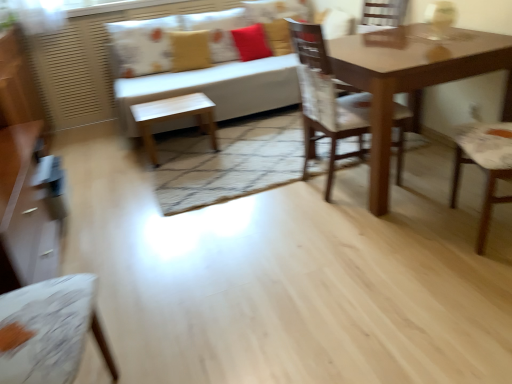
What do you see at coordinates (142, 46) in the screenshot?
I see `printed fabric pillow at upper center, which is counted as the third pillow, starting from the right` at bounding box center [142, 46].

Identify the location of white fabric couch at upper center. This screenshot has width=512, height=384. (217, 88).

In the scene shown: What is the approximate height of matte brown dresser at left?

The height of matte brown dresser at left is 99.64 centimeters.

Find the location of `matte yellow pillow at upper center, arranged as the second pillow when viewed from the left`. matte yellow pillow at upper center, arranged as the second pillow when viewed from the left is located at coordinates (190, 50).

How much space does matte yellow pillow at upper center, which is the 2th pillow from right to left, occupy vertically?

matte yellow pillow at upper center, which is the 2th pillow from right to left, is 15.11 inches tall.

What is the approximate height of red velvet cushion at upper center, the 3th pillow positioned from the left?

red velvet cushion at upper center, the 3th pillow positioned from the left, is 39.88 centimeters tall.

What do you see at coordinates (173, 118) in the screenshot? I see `light wood/finely finished table at center` at bounding box center [173, 118].

Where is `printed fabric pillow at upper center, which is counted as the third pillow, starting from the right`? The width and height of the screenshot is (512, 384). printed fabric pillow at upper center, which is counted as the third pillow, starting from the right is located at coordinates (142, 46).

Is white fabric couch at upper center facing towards matte brown table at center?

Yes, white fabric couch at upper center faces towards matte brown table at center.

This screenshot has height=384, width=512. What are the coordinates of `round table to the right of white fabric couch at upper center` in the screenshot? It's located at (413, 83).

From the image's perspective, is white fabric couch at upper center located above or below matte brown table at center?

Based on their image positions, white fabric couch at upper center is located above matte brown table at center.

Considering the points (247, 36) and (174, 70), which point is in front, point (247, 36) or point (174, 70)?

The point (174, 70) is in front.

Is red velvet cushion at upper center, the 1th pillow when ordered from right to left, positioned beyond the bounds of matte yellow pillow at upper center, arranged as the second pillow when viewed from the left?

Yes, red velvet cushion at upper center, the 1th pillow when ordered from right to left, is not within matte yellow pillow at upper center, arranged as the second pillow when viewed from the left.

Which of these two, red velvet cushion at upper center, the 1th pillow when ordered from right to left, or matte yellow pillow at upper center, arranged as the second pillow when viewed from the left, is thinner?

matte yellow pillow at upper center, arranged as the second pillow when viewed from the left, is thinner.

Consider the image. From the image's perspective, between red velvet cushion at upper center, the 1th pillow when ordered from right to left, and matte yellow pillow at upper center, which is the 2th pillow from right to left, who is located below?

matte yellow pillow at upper center, which is the 2th pillow from right to left, is shown below in the image.

Consider the image. From the image's perspective, who appears lower, printed fabric pillow at upper center, which is counted as the third pillow, starting from the right, or white fabric couch at upper center?

white fabric couch at upper center, from the image's perspective.

In terms of width, does printed fabric pillow at upper center, arranged as the 1th pillow when viewed from the left, look wider or thinner when compared to white fabric couch at upper center?

printed fabric pillow at upper center, arranged as the 1th pillow when viewed from the left, is thinner than white fabric couch at upper center.

Considering the positions of point (137, 48) and point (132, 118), is point (137, 48) closer or farther from the camera than point (132, 118)?

Clearly, point (137, 48) is more distant from the camera than point (132, 118).

Is point (186, 45) positioned before point (148, 114)?

That is False.

From the image's perspective, which is above, matte yellow pillow at upper center, arranged as the second pillow when viewed from the left, or light wood/finely finished table at center?

matte yellow pillow at upper center, arranged as the second pillow when viewed from the left, is shown above in the image.

Can you confirm if wooden chair at center is taller than white fabric couch at upper center?

Indeed, wooden chair at center has a greater height compared to white fabric couch at upper center.

Is point (320, 73) closer to camera compared to point (256, 107)?

Yes, point (320, 73) is in front of point (256, 107).

From a real-world perspective, between wooden chair at center and white fabric couch at upper center, who is vertically lower?

In real-world perspective, white fabric couch at upper center is lower.

Is wooden chair at center further to the viewer compared to white fabric couch at upper center?

That is False.

Can you confirm if matte brown dresser at left is bigger than light wood/finely finished table at center?

Yes.

You are a GUI agent. You are given a task and a screenshot of the screen. Output one action in this format:
    pyautogui.click(x=<x>, y=<y>)
    Task: Click on the table lying on the right of matte brown dresser at left
    The image size is (512, 384).
    Given the screenshot: What is the action you would take?
    tap(173, 118)

Is light wood/finely finished table at center at the back of matte brown dresser at left?

No, matte brown dresser at left is not facing away from light wood/finely finished table at center.

Is matte brown dresser at left behind light wood/finely finished table at center?

No, the depth of matte brown dresser at left is less than that of light wood/finely finished table at center.

From a real-world perspective, is light wood/finely finished table at center positioned under matte brown table at center based on gravity?

Yes, from a real-world perspective, light wood/finely finished table at center is beneath matte brown table at center.

Which of these two, light wood/finely finished table at center or matte brown table at center, stands taller?

matte brown table at center is taller.

From the picture: Which is closer to the camera, (152, 115) or (479, 42)?

Point (152, 115).

Identify the location of round table below the white fabric couch at upper center (from the image's perspective). This screenshot has width=512, height=384. (413, 83).

I want to click on the 1st pillow to the left of the red velvet cushion at upper center, the 1th pillow when ordered from right to left, starting your count from the anchor, so click(x=190, y=50).

From the picture: When comparing their distances from printed fabric pillow at upper center, arranged as the 1th pillow when viewed from the left, does matte brown table at center or matte yellow pillow at upper center, which is the 2th pillow from right to left, seem closer?

Among the two, matte yellow pillow at upper center, which is the 2th pillow from right to left, is located nearer to printed fabric pillow at upper center, arranged as the 1th pillow when viewed from the left.

Looking at the image, which one is located further to wooden chair at center, white fabric couch at upper center or matte brown table at center?

Based on the image, white fabric couch at upper center appears to be further to wooden chair at center.

Estimate the real-world distances between objects in this image. Which object is further from printed fabric pillow at upper center, which is counted as the third pillow, starting from the right, light wood/finely finished table at center or matte yellow pillow at upper center, arranged as the second pillow when viewed from the left?

light wood/finely finished table at center is further to printed fabric pillow at upper center, which is counted as the third pillow, starting from the right.

Estimate the real-world distances between objects in this image. Which object is closer to matte yellow pillow at upper center, arranged as the second pillow when viewed from the left, light wood/finely finished table at center or printed fabric pillow at upper center, which is counted as the third pillow, starting from the right?

The object closer to matte yellow pillow at upper center, arranged as the second pillow when viewed from the left, is printed fabric pillow at upper center, which is counted as the third pillow, starting from the right.

Looking at the image, which one is located closer to matte yellow pillow at upper center, arranged as the second pillow when viewed from the left, matte brown dresser at left or red velvet cushion at upper center, the 1th pillow when ordered from right to left?

The object closer to matte yellow pillow at upper center, arranged as the second pillow when viewed from the left, is red velvet cushion at upper center, the 1th pillow when ordered from right to left.

When comparing their distances from white fabric couch at upper center, does printed fabric pillow at upper center, arranged as the 1th pillow when viewed from the left, or light wood/finely finished table at center seem closer?

light wood/finely finished table at center.

Considering their positions, is matte brown table at center positioned further to matte brown dresser at left than printed fabric pillow at upper center, which is counted as the third pillow, starting from the right?

Based on the image, matte brown table at center appears to be further to matte brown dresser at left.

From the image, which object appears to be farther from red velvet cushion at upper center, the 1th pillow when ordered from right to left, printed fabric pillow at upper center, arranged as the 1th pillow when viewed from the left, or wooden chair at center?

wooden chair at center lies further to red velvet cushion at upper center, the 1th pillow when ordered from right to left, than the other object.

You are a GUI agent. You are given a task and a screenshot of the screen. Output one action in this format:
    pyautogui.click(x=<x>, y=<y>)
    Task: Click on the chair positioned between matte brown table at center and matte yellow pillow at upper center, arranged as the second pillow when viewed from the left, from near to far
    Image resolution: width=512 pixels, height=384 pixels.
    Given the screenshot: What is the action you would take?
    pyautogui.click(x=326, y=100)

In order to click on chair located between matte brown table at center and white fabric couch at upper center in the depth direction in this screenshot , I will do `click(326, 100)`.

Locate an element on the screen. The height and width of the screenshot is (384, 512). table between matte brown table at center and matte yellow pillow at upper center, which is the 2th pillow from right to left, from front to back is located at coordinates (173, 118).

Locate an element on the screen. chair located between light wood/finely finished table at center and matte brown table at center in the left-right direction is located at coordinates click(x=326, y=100).